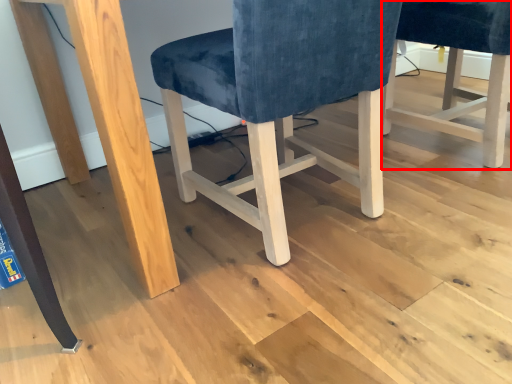
Question: Where is chair (annotated by the red box) located in relation to chair in the image?

Choices:
 (A) left
 (B) right

Answer: (B)